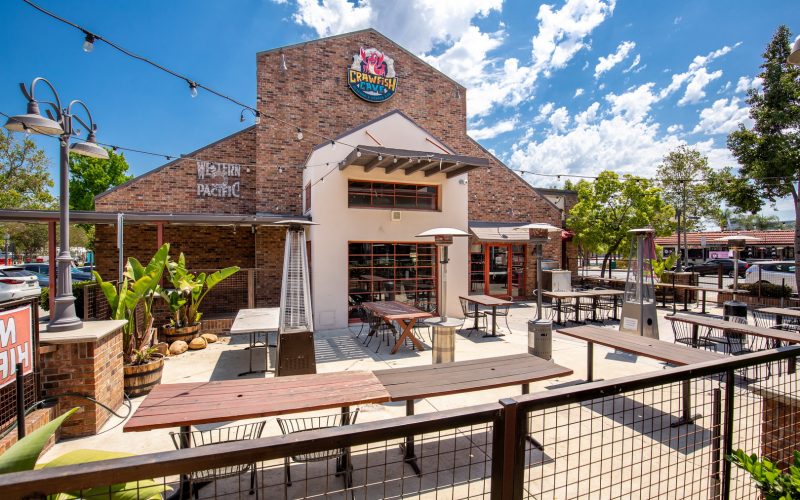
Locate an element on the screen. Image resolution: width=800 pixels, height=500 pixels. chair is located at coordinates (340, 405).